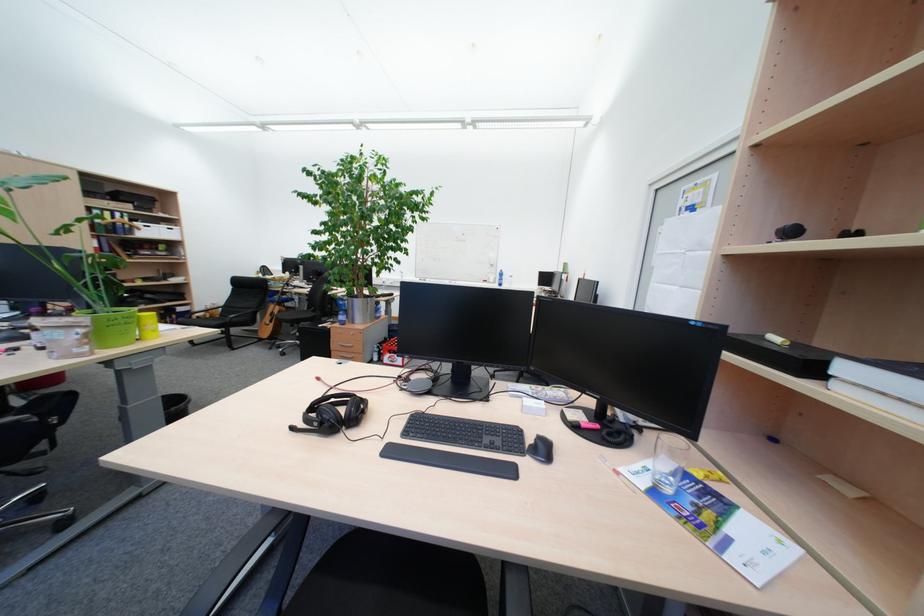
The location [76,264] corresponds to which object?

It corresponds to the green planter pot in the image.